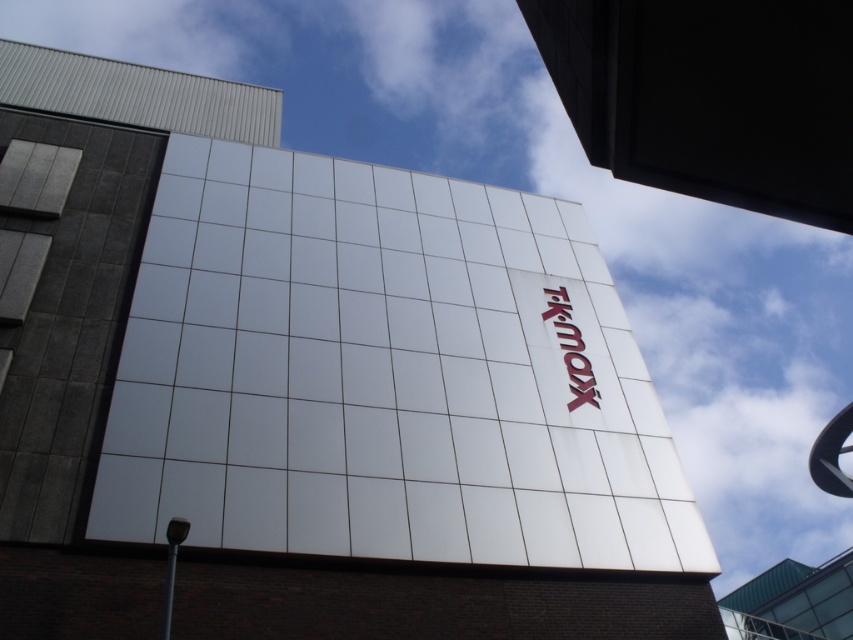
Question: Is the position of white glossy sign at upper center more distant than that of red glossy sign at upper center?

Choices:
 (A) no
 (B) yes

Answer: (A)

Question: Is white glossy sign at upper center smaller than red glossy sign at upper center?

Choices:
 (A) no
 (B) yes

Answer: (B)

Question: Which point is farther to the camera?

Choices:
 (A) white glossy sign at upper center
 (B) red glossy sign at upper center

Answer: (B)

Question: Is white glossy sign at upper center wider than red glossy sign at upper center?

Choices:
 (A) no
 (B) yes

Answer: (A)

Question: Which point is closer to the camera taking this photo?

Choices:
 (A) (584, 397)
 (B) (657, 24)

Answer: (B)

Question: Among these objects, which one is farthest from the camera?

Choices:
 (A) white glossy sign at upper center
 (B) red glossy sign at upper center

Answer: (B)